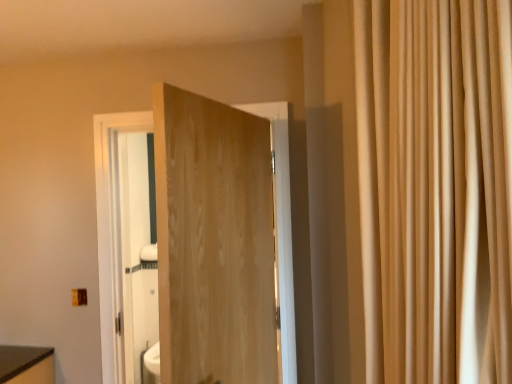
Question: Can you confirm if beige fabric curtain at right is smaller than natural wood door at center?

Choices:
 (A) no
 (B) yes

Answer: (A)

Question: Considering the relative sizes of beige fabric curtain at right and natural wood door at center in the image provided, is beige fabric curtain at right wider than natural wood door at center?

Choices:
 (A) no
 (B) yes

Answer: (B)

Question: Is beige fabric curtain at right bigger than natural wood door at center?

Choices:
 (A) no
 (B) yes

Answer: (B)

Question: Is beige fabric curtain at right facing towards natural wood door at center?

Choices:
 (A) yes
 (B) no

Answer: (B)

Question: Is beige fabric curtain at right thinner than natural wood door at center?

Choices:
 (A) yes
 (B) no

Answer: (B)

Question: Considering the relative positions of beige fabric curtain at right and natural wood door at center in the image provided, is beige fabric curtain at right to the left of natural wood door at center from the viewer's perspective?

Choices:
 (A) yes
 (B) no

Answer: (B)

Question: Is natural wood door at center looking in the opposite direction of beige fabric curtain at right?

Choices:
 (A) yes
 (B) no

Answer: (A)

Question: Considering the relative sizes of natural wood door at center and beige fabric curtain at right in the image provided, is natural wood door at center bigger than beige fabric curtain at right?

Choices:
 (A) no
 (B) yes

Answer: (A)

Question: Would you consider natural wood door at center to be distant from beige fabric curtain at right?

Choices:
 (A) yes
 (B) no

Answer: (A)

Question: Considering the relative sizes of natural wood door at center and beige fabric curtain at right in the image provided, is natural wood door at center thinner than beige fabric curtain at right?

Choices:
 (A) yes
 (B) no

Answer: (A)

Question: Does natural wood door at center appear on the right side of beige fabric curtain at right?

Choices:
 (A) no
 (B) yes

Answer: (A)

Question: Does natural wood door at center have a smaller size compared to beige fabric curtain at right?

Choices:
 (A) yes
 (B) no

Answer: (A)

Question: Looking at the image, does beige fabric curtain at right seem bigger or smaller compared to natural wood door at center?

Choices:
 (A) small
 (B) big

Answer: (B)